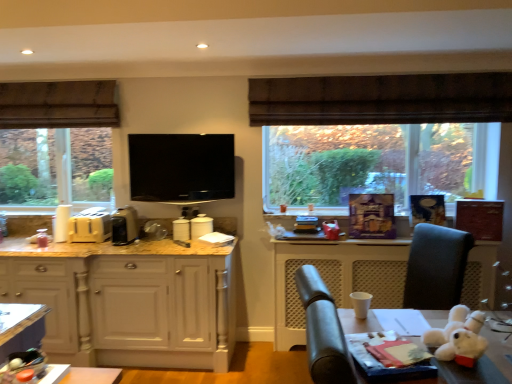
Question: In which direction should I rotate to look at white glossy canister at center, arranged as the 4th appliance when viewed from the left?

Choices:
 (A) left
 (B) right

Answer: (A)

Question: Is brown fabric exhaust hood at upper left positioned with its back to white glossy toaster at center, which is counted as the second appliance, starting from the right?

Choices:
 (A) no
 (B) yes

Answer: (A)

Question: Considering the relative sizes of brown fabric exhaust hood at upper left and white glossy toaster at center, the 3th appliance viewed from the left, in the image provided, is brown fabric exhaust hood at upper left bigger than white glossy toaster at center, the 3th appliance viewed from the left,?

Choices:
 (A) yes
 (B) no

Answer: (A)

Question: Is brown fabric exhaust hood at upper left not close to white glossy toaster at center, which is counted as the second appliance, starting from the right?

Choices:
 (A) no
 (B) yes

Answer: (B)

Question: Is brown fabric exhaust hood at upper left located outside white glossy toaster at center, the 3th appliance viewed from the left?

Choices:
 (A) yes
 (B) no

Answer: (A)

Question: Is brown fabric exhaust hood at upper left positioned in front of white glossy toaster at center, the 3th appliance viewed from the left?

Choices:
 (A) no
 (B) yes

Answer: (A)

Question: Considering the relative sizes of brown fabric exhaust hood at upper left and white glossy toaster at center, the 3th appliance viewed from the left, in the image provided, is brown fabric exhaust hood at upper left smaller than white glossy toaster at center, the 3th appliance viewed from the left,?

Choices:
 (A) no
 (B) yes

Answer: (A)

Question: Is metallic silver coffee machine at left, which ranks as the 3th appliance in right-to-left order, wider than white paper at lower right?

Choices:
 (A) yes
 (B) no

Answer: (A)

Question: Is metallic silver coffee machine at left, which ranks as the 3th appliance in right-to-left order, behind white paper at lower right?

Choices:
 (A) no
 (B) yes

Answer: (A)

Question: Could you tell me if metallic silver coffee machine at left, acting as the second appliance starting from the left, is turned towards white paper at lower right?

Choices:
 (A) yes
 (B) no

Answer: (B)

Question: Does metallic silver coffee machine at left, which ranks as the 3th appliance in right-to-left order, have a smaller size compared to white paper at lower right?

Choices:
 (A) no
 (B) yes

Answer: (B)

Question: Is metallic silver coffee machine at left, acting as the second appliance starting from the left, in contact with white paper at lower right?

Choices:
 (A) no
 (B) yes

Answer: (A)

Question: Is metallic silver coffee machine at left, which ranks as the 3th appliance in right-to-left order, not within white paper at lower right?

Choices:
 (A) yes
 (B) no

Answer: (A)

Question: From a real-world perspective, does black glossy tv at center sit lower than white paper at lower right?

Choices:
 (A) no
 (B) yes

Answer: (A)